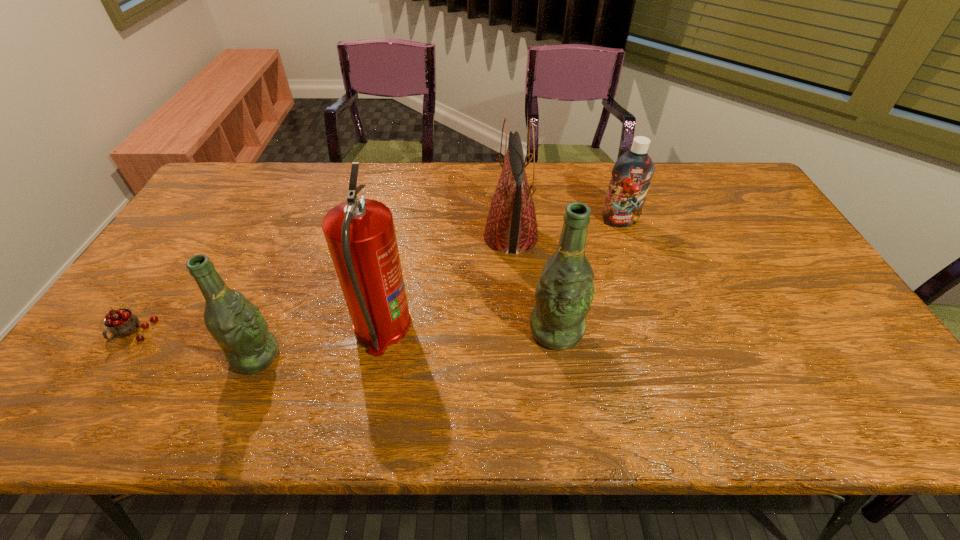
Image resolution: width=960 pixels, height=540 pixels. I want to click on vacant space that is in between the left beer bottle and the leftmost object, so click(x=195, y=345).

The height and width of the screenshot is (540, 960). Identify the location of free space between the fourth object from right to left and the handbag. (446, 282).

Identify the location of free space between the fire extinguisher and the right beer bottle. Image resolution: width=960 pixels, height=540 pixels. (469, 329).

Identify the location of unoccupied area between the fire extinguisher and the shorter beer bottle. This screenshot has width=960, height=540. (320, 342).

Image resolution: width=960 pixels, height=540 pixels. Identify the location of vacant space in between the third object from left to right and the right beer bottle. (469, 329).

Locate an element on the screen. This screenshot has width=960, height=540. vacant space that is in between the third object from left to right and the taller beer bottle is located at coordinates (469, 329).

Where is `unoccupied position between the left beer bottle and the shortest object`? unoccupied position between the left beer bottle and the shortest object is located at coordinates (195, 345).

Identify the location of vacant area that lies between the fire extinguisher and the second object from left to right. (320, 342).

Where is `free space between the handbag and the taller beer bottle`? The height and width of the screenshot is (540, 960). free space between the handbag and the taller beer bottle is located at coordinates (534, 284).

Locate an element on the screen. object that is the fifth nearest to the right beer bottle is located at coordinates (121, 323).